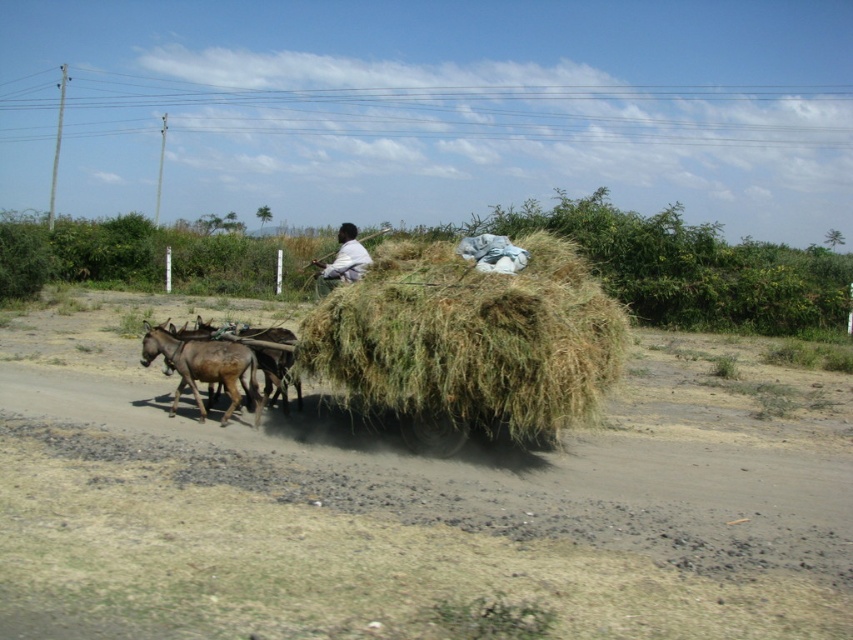
Who is higher up, brown rough mule at left or white cotton shirt at center?

white cotton shirt at center is above.

Does point (236, 394) come farther from viewer compared to point (352, 266)?

That is False.

What are the coordinates of `brown rough mule at left` in the screenshot? It's located at (202, 368).

Does point (506, 304) come in front of point (202, 381)?

Yes, it is in front of point (202, 381).

Does green straw at center have a lesser width compared to brown rough mule at left?

No.

Who is more distant from viewer, (x=433, y=301) or (x=171, y=349)?

The point (x=171, y=349) is behind.

Locate an element on the screen. This screenshot has height=640, width=853. green straw at center is located at coordinates (469, 340).

Who is more distant from viewer, [421,376] or [360,275]?

Point [360,275]

Can you confirm if green straw at center is positioned above white cotton shirt at center?

Actually, green straw at center is below white cotton shirt at center.

Where is `green straw at center`? green straw at center is located at coordinates (469, 340).